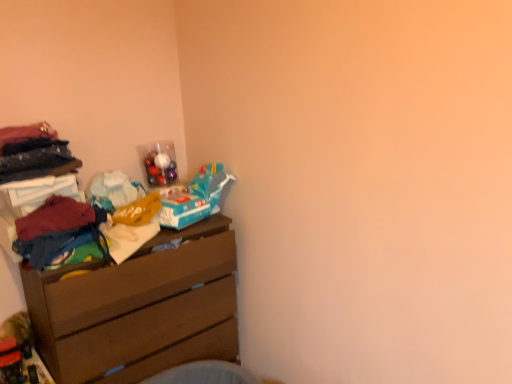
Question: Would you say multicolored fabric at left is inside or outside brown wooden chest of drawers at left?

Choices:
 (A) outside
 (B) inside

Answer: (A)

Question: Considering their positions, is multicolored fabric at left located in front of or behind brown wooden chest of drawers at left?

Choices:
 (A) front
 (B) behind

Answer: (A)

Question: Is point (57, 236) positioned closer to the camera than point (185, 259)?

Choices:
 (A) closer
 (B) farther

Answer: (A)

Question: Is brown wooden chest of drawers at left taller or shorter than multicolored fabric at left?

Choices:
 (A) short
 (B) tall

Answer: (B)

Question: In the image, is brown wooden chest of drawers at left positioned in front of or behind multicolored fabric at left?

Choices:
 (A) front
 (B) behind

Answer: (B)

Question: Is point (204, 274) positioned closer to the camera than point (65, 226)?

Choices:
 (A) farther
 (B) closer

Answer: (A)

Question: Considering the positions of brown wooden chest of drawers at left and multicolored fabric at left in the image, is brown wooden chest of drawers at left bigger or smaller than multicolored fabric at left?

Choices:
 (A) big
 (B) small

Answer: (A)